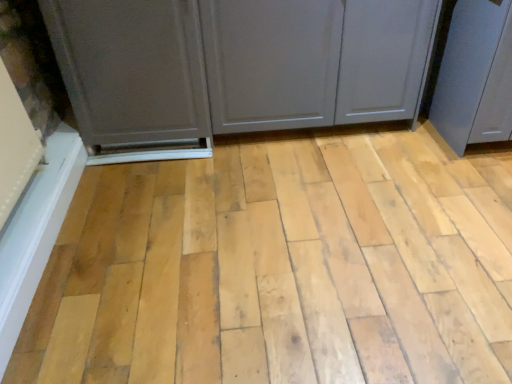
Question: From a real-world perspective, relative to natural wood plank at center, is matte gray screen door at right, which appears as the 2th screen door when viewed from the left, vertically above or below?

Choices:
 (A) below
 (B) above

Answer: (B)

Question: In terms of size, does matte gray screen door at right, which appears as the 2th screen door when viewed from the left, appear bigger or smaller than natural wood plank at center?

Choices:
 (A) small
 (B) big

Answer: (B)

Question: Estimate the real-world distances between objects in this image. Which object is closer to the natural wood plank at center?

Choices:
 (A) matte gray cabinet at left, which appears as the second screen door when viewed from the right
 (B) matte gray cupboard at center
 (C) matte gray screen door at right, the first screen door in the right-to-left sequence

Answer: (B)

Question: Which of these objects is positioned closest to the natural wood plank at center?

Choices:
 (A) matte gray cabinet at left, the first screen door when ordered from left to right
 (B) matte gray cupboard at center
 (C) matte gray screen door at right, the first screen door in the right-to-left sequence

Answer: (B)